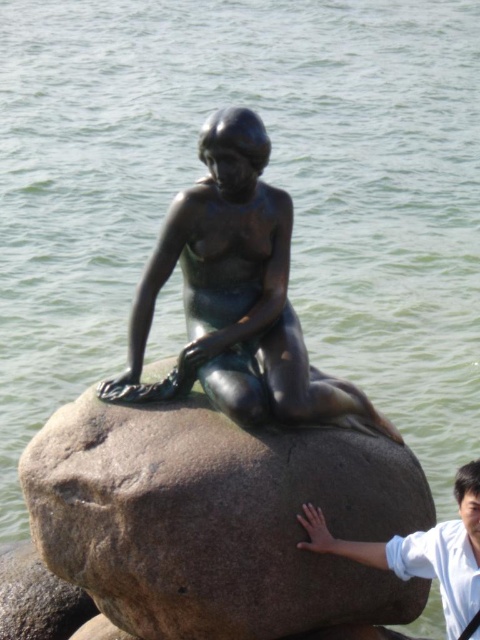
Question: Which point appears closest to the camera in this image?

Choices:
 (A) (25, 593)
 (B) (275, 531)
 (C) (372, 557)

Answer: (B)

Question: Which point is farther to the camera?

Choices:
 (A) (158, 412)
 (B) (4, 580)
 (C) (207, 253)

Answer: (B)

Question: Is bronze statue at center positioned at the back of gray granite rock at center?

Choices:
 (A) no
 (B) yes

Answer: (A)

Question: Is granite rock at center positioned in front of bronze statue at center?

Choices:
 (A) no
 (B) yes

Answer: (B)

Question: Which object is farther from the camera taking this photo?

Choices:
 (A) white shirt at center
 (B) bronze statue at center
 (C) granite rock at center

Answer: (B)

Question: Is granite rock at center to the left of bronze statue at center from the viewer's perspective?

Choices:
 (A) yes
 (B) no

Answer: (B)